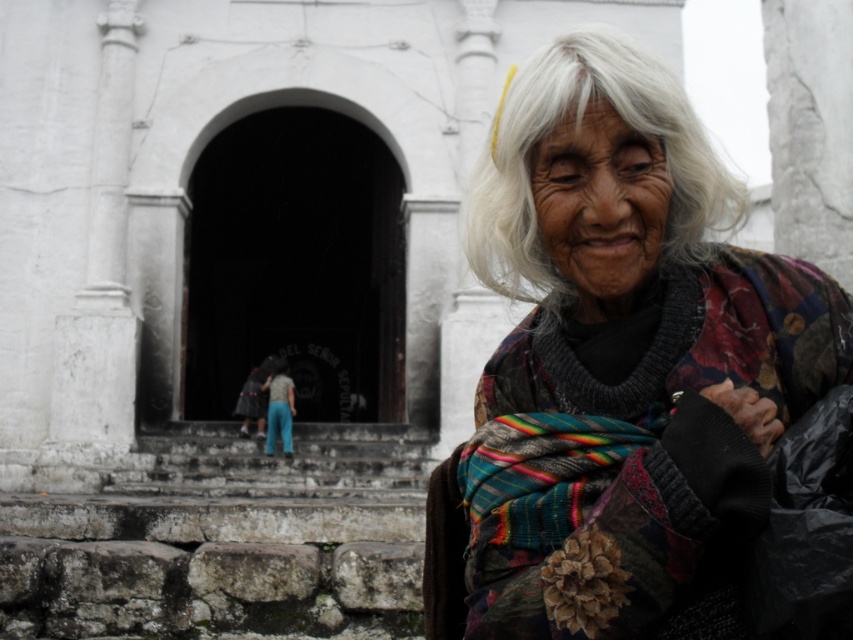
You are a photographer trying to capture the multicolored woven shawl at center in your shot. The camera you are using has a focus point at coordinate 0.5, 0.7. Will the focus point be sufficient to capture the shawl clearly?

The multicolored woven shawl at center is located at point (621, 362). The camera focus point is at (596, 320). The distance between the focus point and the shawl is sqrt of squared differences of coordinates, which is sqrt of 0.067 squared plus 0.029 squared. That equals approximately sqrt of 0.004489 plus 0.000841, totaling sqrt of 0.00533, which is about 0.073. Since this distance is small, the focus point at (596, 320) should be sufficient to capture the multicolored woven shawl at center clearly.